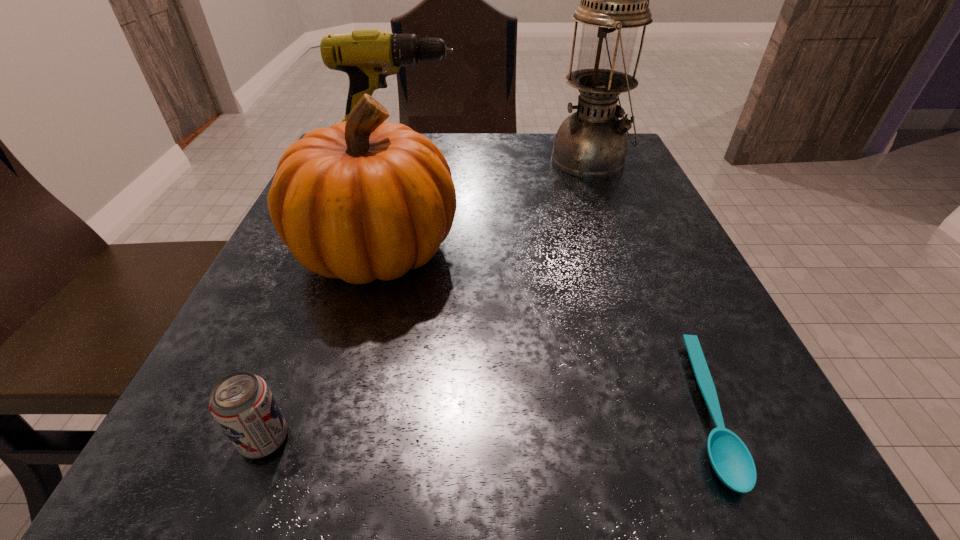
You are a GUI agent. You are given a task and a screenshot of the screen. Output one action in this format:
    pyautogui.click(x=<x>, y=<y>)
    Task: Click on the oil lamp
    This screenshot has height=540, width=960.
    Given the screenshot: What is the action you would take?
    pyautogui.click(x=591, y=143)

Find the location of a particular element. This screenshot has width=960, height=540. drill is located at coordinates (368, 56).

At what (x,y) coordinates should I click in order to perform the action: click on the third nearest object. Please return your answer as a coordinate pair (x, y). The width and height of the screenshot is (960, 540). Looking at the image, I should click on (362, 200).

This screenshot has width=960, height=540. I want to click on the second shortest object, so click(x=242, y=404).

Find the location of a particular element. The width and height of the screenshot is (960, 540). the shortest object is located at coordinates (x=731, y=460).

The height and width of the screenshot is (540, 960). Identify the location of free region located 0.240m on the front of the tallest object. (625, 248).

What are the coordinates of `blank space located on the handle side of the drill` in the screenshot? It's located at (548, 156).

Find the location of `free space located on the back of the third farthest object`. free space located on the back of the third farthest object is located at coordinates tap(405, 145).

Find the location of a particular element. free space located on the back of the beer can is located at coordinates (297, 356).

Where is `free point located 0.390m on the back of the shortest object`? free point located 0.390m on the back of the shortest object is located at coordinates (612, 194).